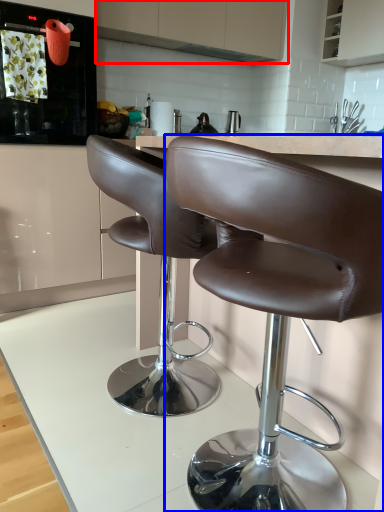
Question: Which of the following is the farthest to the observer, cabinetry (highlighted by a red box) or chair (highlighted by a blue box)?

Choices:
 (A) cabinetry
 (B) chair

Answer: (A)